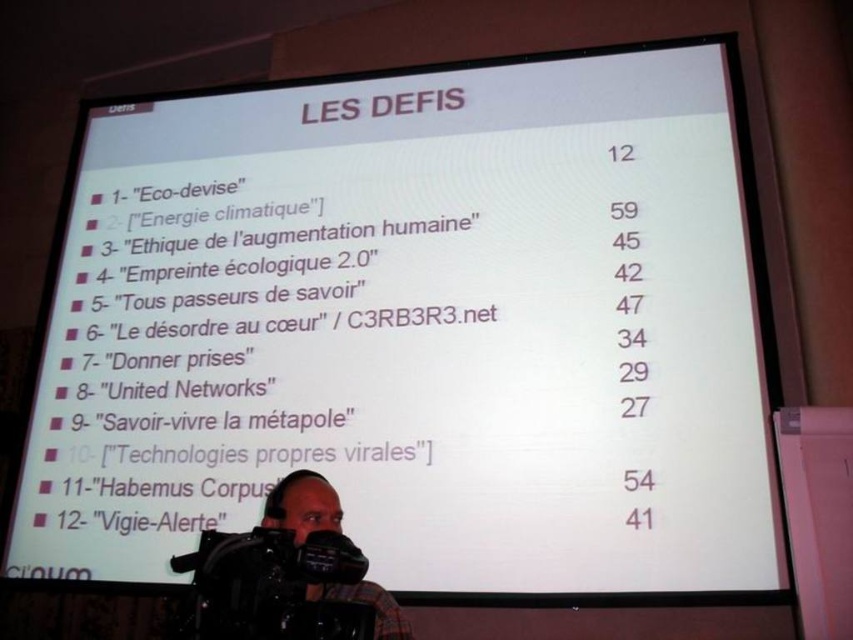
You are attending a presentation and notice two cameras in the image. The black plastic camera at lower left and the plaid fabric camera at lower center. Which camera is positioned higher on the screen?

The black plastic camera at lower left is located above the plaid fabric camera at lower center, so it is positioned higher on the screen.

You are a conference attendee and you see the black plastic camera at lower left. Where is it positioned relative to the screen?

The black plastic camera at lower left is located at point 0.917 on the x axis and 0.319 on the y axis.

Based on the photo, you are an attendee at a conference and see the black plastic camera at lower left and the plaid fabric camera at lower center. Which camera is positioned more to the left side of the screen?

The black plastic camera at lower left is positioned more to the left side of the screen than the plaid fabric camera at lower center.